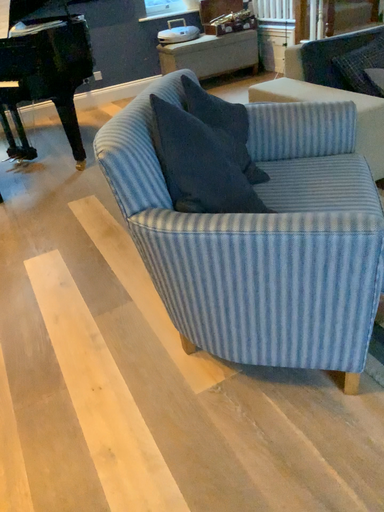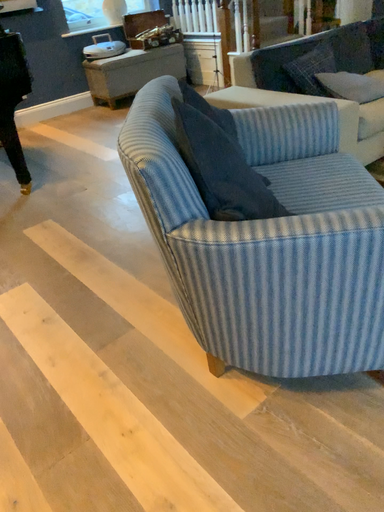
Question: How did the camera likely rotate when shooting the video?

Choices:
 (A) rotated left
 (B) rotated right

Answer: (B)